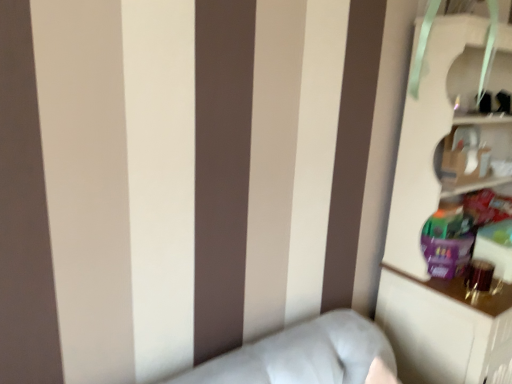
Question: Based on their positions, is white glossy bookcase at right located to the left or right of matte cardboard cabinet at upper right?

Choices:
 (A) left
 (B) right

Answer: (B)

Question: Do you think white glossy bookcase at right is within matte cardboard cabinet at upper right, or outside of it?

Choices:
 (A) outside
 (B) inside

Answer: (A)

Question: Considering the positions of point (378, 291) and point (436, 165), is point (378, 291) closer or farther from the camera than point (436, 165)?

Choices:
 (A) closer
 (B) farther

Answer: (B)

Question: Considering their positions, is matte cardboard cabinet at upper right located in front of or behind white glossy bookcase at right?

Choices:
 (A) behind
 (B) front

Answer: (A)

Question: Is point (503, 115) positioned closer to the camera than point (501, 347)?

Choices:
 (A) farther
 (B) closer

Answer: (A)

Question: Visually, is matte cardboard cabinet at upper right positioned to the left or to the right of white glossy bookcase at right?

Choices:
 (A) right
 (B) left

Answer: (B)

Question: Considering the positions of matte cardboard cabinet at upper right and white glossy bookcase at right in the image, is matte cardboard cabinet at upper right taller or shorter than white glossy bookcase at right?

Choices:
 (A) tall
 (B) short

Answer: (B)